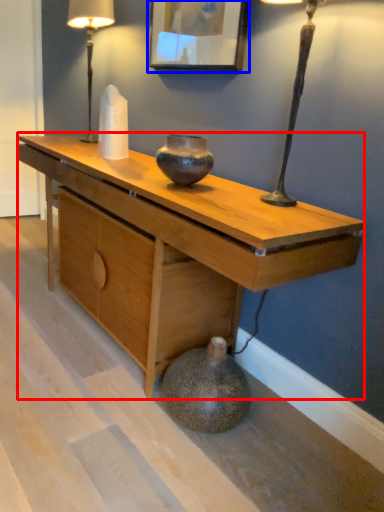
Question: Among these objects, which one is farthest to the camera, desk (highlighted by a red box) or picture frame (highlighted by a blue box)?

Choices:
 (A) desk
 (B) picture frame

Answer: (B)